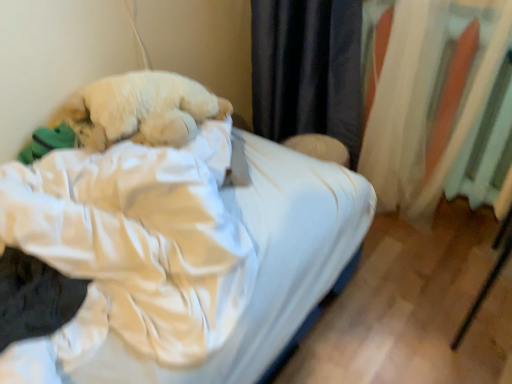
Measure the distance between white satin bed at center and camera.

A distance of 67.82 centimeters exists between white satin bed at center and camera.

Where is `fluffy white dog at center`? The height and width of the screenshot is (384, 512). fluffy white dog at center is located at coordinates (140, 109).

At what (x,y) coordinates should I click in order to perform the action: click on white satin bed at center. Please return your answer as a coordinate pair (x, y). Looking at the image, I should click on (180, 255).

Considering the relative sizes of fluffy white dog at center and white satin bed at center in the image provided, is fluffy white dog at center wider than white satin bed at center?

No, fluffy white dog at center is not wider than white satin bed at center.

From the image's perspective, is fluffy white dog at center located above white satin bed at center?

Yes, from the image's perspective, fluffy white dog at center is over white satin bed at center.

Considering the sizes of fluffy white dog at center and white satin bed at center in the image, is fluffy white dog at center bigger or smaller than white satin bed at center?

Considering their sizes, fluffy white dog at center takes up less space than white satin bed at center.

Image resolution: width=512 pixels, height=384 pixels. I want to click on bed on the right of fluffy white dog at center, so click(180, 255).

Is white satin bed at center taller than fluffy white dog at center?

Correct, white satin bed at center is much taller as fluffy white dog at center.

Is white satin bed at center to the left of fluffy white dog at center from the viewer's perspective?

In fact, white satin bed at center is to the right of fluffy white dog at center.

Between fluffy white dog at center and white fabric curtain at right, which one has larger width?

fluffy white dog at center is wider.

Does fluffy white dog at center have a smaller size compared to white fabric curtain at right?

Correct, fluffy white dog at center occupies less space than white fabric curtain at right.

From the image's perspective, is fluffy white dog at center located above or below white fabric curtain at right?

fluffy white dog at center is below white fabric curtain at right.

Is fluffy white dog at center located outside white fabric curtain at right?

fluffy white dog at center lies outside white fabric curtain at right's area.

Is white fabric curtain at right looking in the opposite direction of fluffy white dog at center?

white fabric curtain at right does not have its back to fluffy white dog at center.

Considering the sizes of white fabric curtain at right and fluffy white dog at center in the image, is white fabric curtain at right taller or shorter than fluffy white dog at center?

Clearly, white fabric curtain at right is taller compared to fluffy white dog at center.

Considering the positions of objects white fabric curtain at right and fluffy white dog at center in the image provided, who is more to the left, white fabric curtain at right or fluffy white dog at center?

fluffy white dog at center.

Is white satin bed at center at the left side of white fabric curtain at right?

Correct, you'll find white satin bed at center to the left of white fabric curtain at right.

Could white fabric curtain at right be considered to be inside white satin bed at center?

No, white fabric curtain at right is not a part of white satin bed at center.

From the image's perspective, which is below, white satin bed at center or white fabric curtain at right?

white satin bed at center appears lower in the image.

From the image's perspective, which one is positioned higher, white fabric curtain at right or white satin bed at center?

From the image's view, white fabric curtain at right is above.

Between white fabric curtain at right and white satin bed at center, which one has larger width?

With larger width is white satin bed at center.

Considering their positions, is white fabric curtain at right located in front of or behind white satin bed at center?

white fabric curtain at right is positioned farther from the viewer than white satin bed at center.

The image size is (512, 384). I want to click on bed below the fluffy white dog at center (from the image's perspective), so click(180, 255).

Find the location of `dog positioned vertically above the white satin bed at center (from a real-world perspective)`. dog positioned vertically above the white satin bed at center (from a real-world perspective) is located at coordinates (140, 109).

From the image, which object appears to be farther from white satin bed at center, white fabric curtain at right or fluffy white dog at center?

white fabric curtain at right.

Based on their spatial positions, is fluffy white dog at center or white satin bed at center further from white fabric curtain at right?

fluffy white dog at center is positioned further to the anchor white fabric curtain at right.

Which object lies further to the anchor point fluffy white dog at center, white fabric curtain at right or white satin bed at center?

Among the two, white fabric curtain at right is located further to fluffy white dog at center.

When comparing their distances from white fabric curtain at right, does white satin bed at center or fluffy white dog at center seem further?

fluffy white dog at center lies further to white fabric curtain at right than the other object.

When comparing their distances from fluffy white dog at center, does white satin bed at center or white fabric curtain at right seem further?

white fabric curtain at right lies further to fluffy white dog at center than the other object.

Looking at the image, which one is located closer to white satin bed at center, fluffy white dog at center or white fabric curtain at right?

fluffy white dog at center.

Find the location of a particular element. The height and width of the screenshot is (384, 512). bed between fluffy white dog at center and white fabric curtain at right is located at coordinates (180, 255).